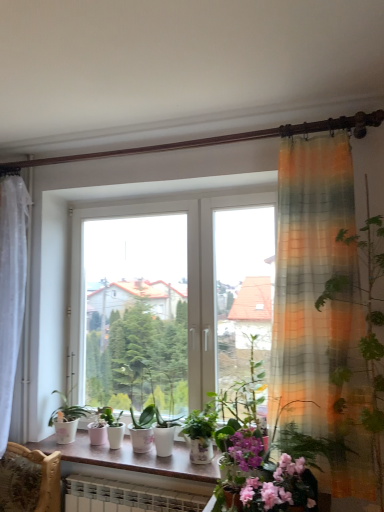
Find the location of a particular element. The height and width of the screenshot is (512, 384). green matte plant at center is located at coordinates (113, 426).

Where is `pink matte flower at lower center`? This screenshot has height=512, width=384. pink matte flower at lower center is located at coordinates (281, 489).

The width and height of the screenshot is (384, 512). Find the location of `white glossy window sill at center`. white glossy window sill at center is located at coordinates (132, 458).

Considering the relative positions of pink matte flower at lower center and white glossy window sill at center in the image provided, is pink matte flower at lower center to the right of white glossy window sill at center from the viewer's perspective?

Correct, you'll find pink matte flower at lower center to the right of white glossy window sill at center.

From a real-world perspective, is pink matte flower at lower center positioned over white glossy window sill at center based on gravity?

Indeed, from a real-world perspective, pink matte flower at lower center stands above white glossy window sill at center.

Based on the photo, is the surface of pink matte flower at lower center in direct contact with white glossy window sill at center?

No, pink matte flower at lower center is not making contact with white glossy window sill at center.

Considering the relative sizes of pink matte flower at lower center and white glossy window sill at center in the image provided, is pink matte flower at lower center taller than white glossy window sill at center?

Indeed, pink matte flower at lower center has a greater height compared to white glossy window sill at center.

Can you tell me how much white glossy window sill at center and pink matte flower at lower center differ in facing direction?

white glossy window sill at center and pink matte flower at lower center are facing 1.23 degrees away from each other.

From a real-world perspective, is white glossy window sill at center positioned under pink matte flower at lower center based on gravity?

Yes.

The image size is (384, 512). Identify the location of window sill located behind the pink matte flower at lower center. (132, 458).

Are white glossy window sill at center and pink matte flower at lower center located far from each other?

No, there isn't a large distance between white glossy window sill at center and pink matte flower at lower center.

Which is correct: white glossy window sill at center is inside green matte plant at center, or outside of it?

white glossy window sill at center is located beyond the bounds of green matte plant at center.

From the picture: Between white glossy window sill at center and green matte plant at center, which one appears on the left side from the viewer's perspective?

green matte plant at center is more to the left.

Does white glossy window sill at center come in front of green matte plant at center?

Yes, the depth of white glossy window sill at center is less than that of green matte plant at center.

Is white glossy window sill at center taller or shorter than green matte plant at center?

In the image, white glossy window sill at center appears to be shorter than green matte plant at center.

This screenshot has width=384, height=512. In order to click on flower below the green matte plant at center (from a real-world perspective) in this screenshot , I will do `click(281, 489)`.

From the image's perspective, is pink matte flower at lower center on green matte plant at center?

Correct, pink matte flower at lower center appears higher than green matte plant at center in the image.

Looking at the image, does pink matte flower at lower center seem bigger or smaller compared to green matte plant at center?

Considering their sizes, pink matte flower at lower center takes up more space than green matte plant at center.

I want to click on flower on the right of green matte plant at center, so click(281, 489).

Is green matte plant at center at the right side of pink matte flower at lower center?

Incorrect, green matte plant at center is not on the right side of pink matte flower at lower center.

Considering the relative sizes of green matte plant at center and pink matte flower at lower center in the image provided, is green matte plant at center wider than pink matte flower at lower center?

In fact, green matte plant at center might be narrower than pink matte flower at lower center.

Does point (109, 426) appear closer or farther from the camera than point (307, 478)?

Point (109, 426).

Can you confirm if green matte plant at center is positioned to the left of white glossy window sill at center?

Yes.

Is green matte plant at center aimed at white glossy window sill at center?

No, green matte plant at center is not turned towards white glossy window sill at center.

Between green matte plant at center and white glossy window sill at center, which one has less height?

With less height is white glossy window sill at center.

Considering the relative sizes of green matte plant at center and white glossy window sill at center in the image provided, is green matte plant at center smaller than white glossy window sill at center?

Correct, green matte plant at center occupies less space than white glossy window sill at center.

Locate an element on the screen. window sill below the pink matte flower at lower center (from the image's perspective) is located at coordinates (132, 458).

What are the coordinates of `window sill located behind the pink matte flower at lower center` in the screenshot? It's located at (132, 458).

When comparing their distances from pink matte flower at lower center, does white glossy window sill at center or green matte plant at center seem closer?

white glossy window sill at center.

Which object lies further to the anchor point green matte plant at center, pink matte flower at lower center or white glossy window sill at center?

The object further to green matte plant at center is pink matte flower at lower center.

Based on their spatial positions, is green matte plant at center or white glossy window sill at center closer to pink matte flower at lower center?

white glossy window sill at center is closer to pink matte flower at lower center.

When comparing their distances from green matte plant at center, does white glossy window sill at center or pink matte flower at lower center seem closer?

The object closer to green matte plant at center is white glossy window sill at center.

When comparing their distances from white glossy window sill at center, does green matte plant at center or pink matte flower at lower center seem further?

The object further to white glossy window sill at center is pink matte flower at lower center.

From the image, which object appears to be farther from white glossy window sill at center, pink matte flower at lower center or green matte plant at center?

pink matte flower at lower center.

I want to click on window sill positioned between pink matte flower at lower center and green matte plant at center from near to far, so click(132, 458).